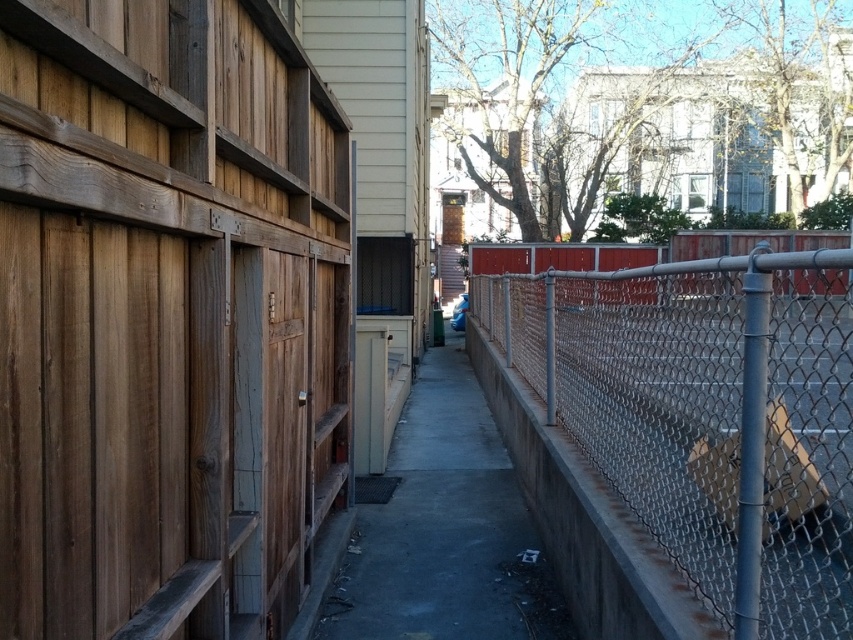
Question: Which object is closer to the camera taking this photo?

Choices:
 (A) rusty chain-link fence at right
 (B) gray concrete pavement at center

Answer: (A)

Question: Is rusty chain-link fence at right closer to the viewer compared to gray concrete pavement at center?

Choices:
 (A) no
 (B) yes

Answer: (B)

Question: Which object is farther from the camera taking this photo?

Choices:
 (A) rusty chain-link fence at right
 (B) gray concrete pavement at center

Answer: (B)

Question: Which object is farther from the camera taking this photo?

Choices:
 (A) gray concrete pavement at center
 (B) rusty chain-link fence at right

Answer: (A)

Question: Is rusty chain-link fence at right bigger than gray concrete pavement at center?

Choices:
 (A) no
 (B) yes

Answer: (B)

Question: Observing the image, what is the correct spatial positioning of rusty chain-link fence at right in reference to gray concrete pavement at center?

Choices:
 (A) above
 (B) below

Answer: (A)